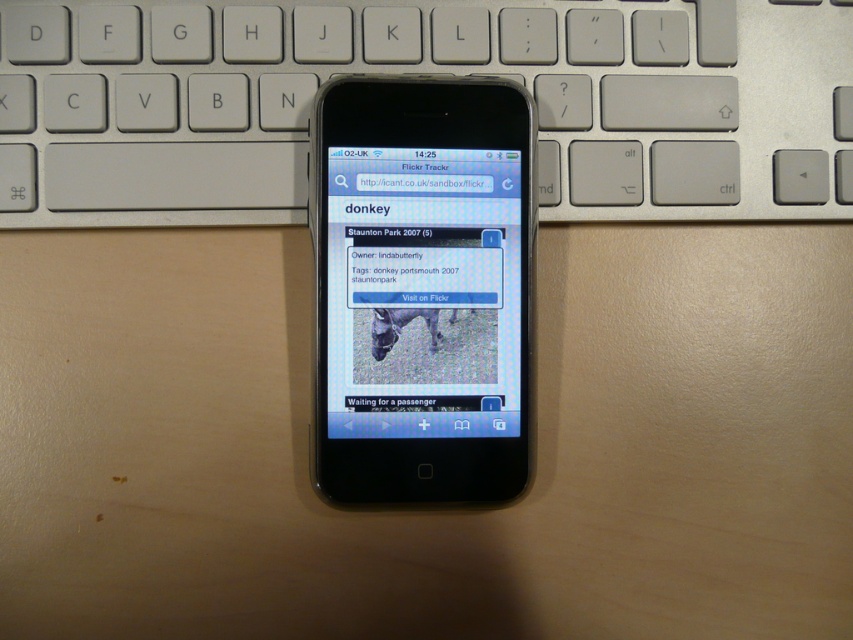
Question: Which of the following is the closest to the observer?

Choices:
 (A) (479, 8)
 (B) (497, 218)

Answer: (B)

Question: Which object is closer to the camera taking this photo?

Choices:
 (A) silver metallic keyboard at center
 (B) matte black screen at center

Answer: (B)

Question: Does silver metallic keyboard at center appear over matte black screen at center?

Choices:
 (A) yes
 (B) no

Answer: (A)

Question: Is silver metallic keyboard at center above matte black screen at center?

Choices:
 (A) yes
 (B) no

Answer: (A)

Question: Does silver metallic keyboard at center have a larger size compared to matte black screen at center?

Choices:
 (A) no
 (B) yes

Answer: (B)